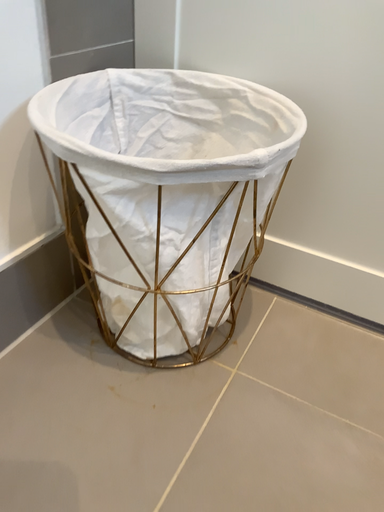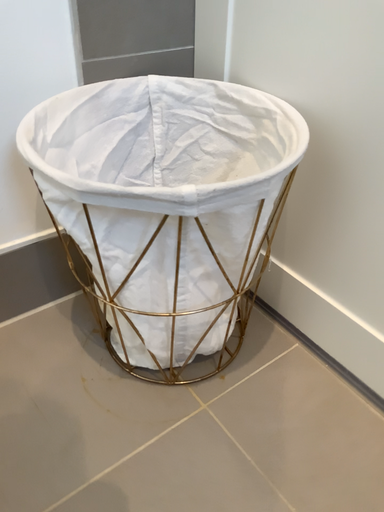
Question: Which way did the camera rotate in the video?

Choices:
 (A) rotated right
 (B) rotated left

Answer: (B)